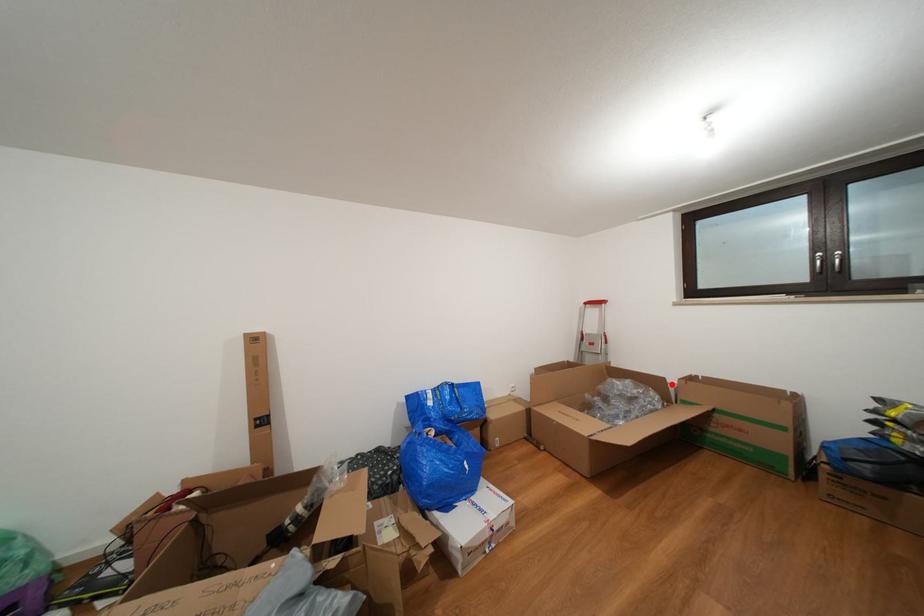
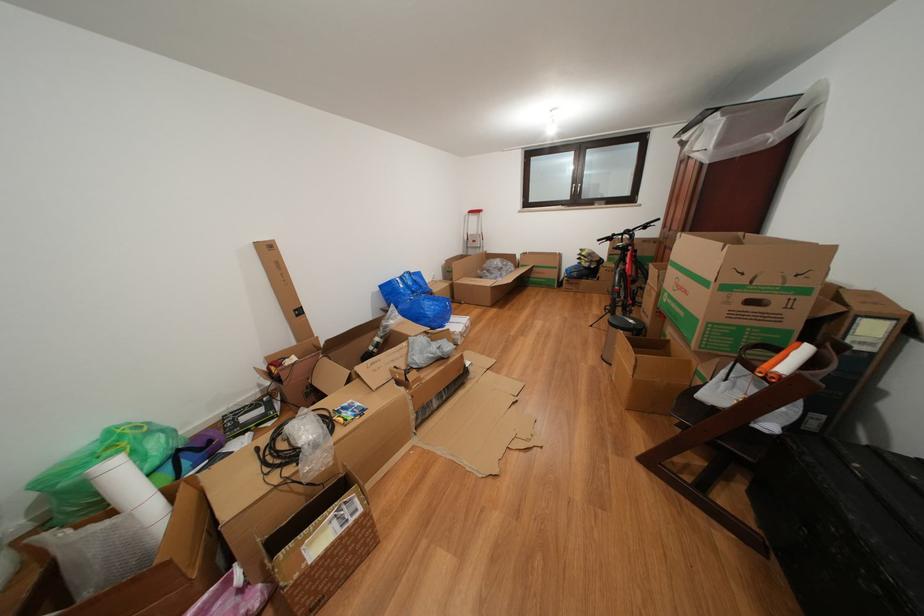
Question: I am providing you with two images of the same scene from different viewpoints. Image1 has a red point marked. In image2, the corresponding 3D location appears at what relative position? Reply with the corresponding letter.

Choices:
 (A) Closer
 (B) Farther

Answer: (A)